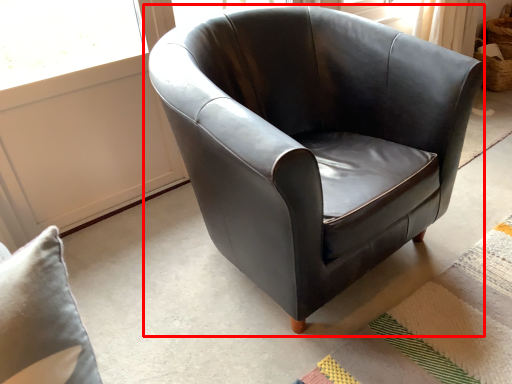
Question: From the image, what is the correct spatial relationship of chair (annotated by the red box) in relation to mat?

Choices:
 (A) right
 (B) left

Answer: (B)